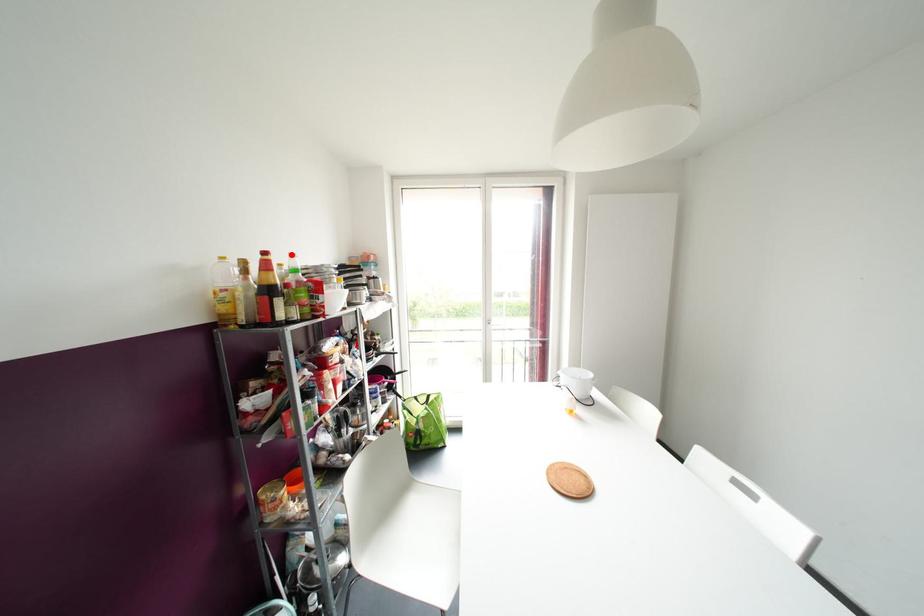
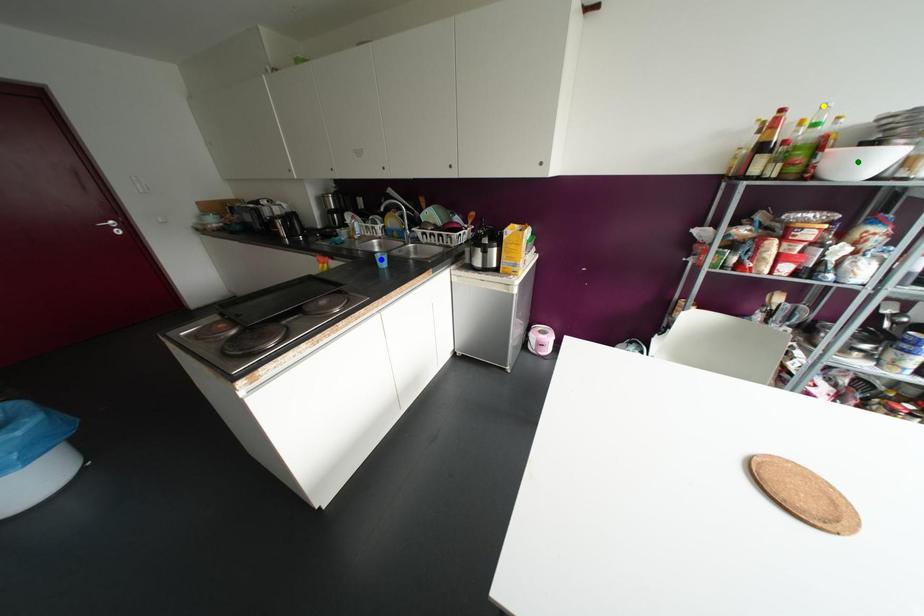
Question: I am providing you with two images of the same scene from different viewpoints. A red point is marked on the first image. You are given multiple points on the second image. Which mark in image 2 goes with the point in image 1?

Choices:
 (A) yellow point
 (B) blue point
 (C) green point

Answer: (A)